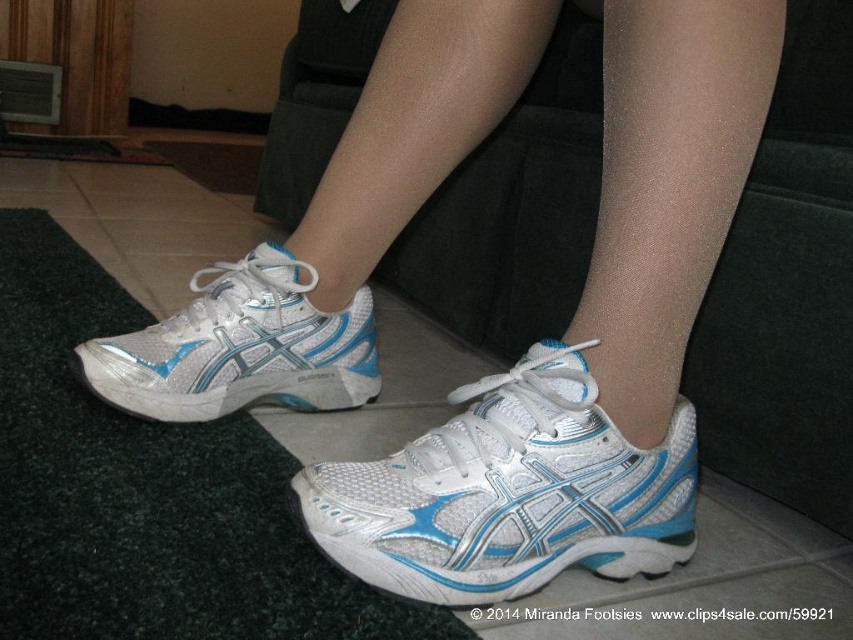
Question: Is white mesh shoe at center closer to the viewer compared to white mesh shoe at left?

Choices:
 (A) no
 (B) yes

Answer: (B)

Question: Does white mesh shoe at center appear over white mesh shoe at left?

Choices:
 (A) no
 (B) yes

Answer: (A)

Question: Which object is closer to the camera taking this photo?

Choices:
 (A) white mesh shoe at left
 (B) white mesh shoe at center

Answer: (B)

Question: Which point is farther from the camera taking this photo?

Choices:
 (A) click(x=186, y=358)
 (B) click(x=596, y=516)

Answer: (A)

Question: Which of the following is the closest to the observer?

Choices:
 (A) white mesh shoe at left
 (B) white mesh shoe at center

Answer: (B)

Question: Can you confirm if white mesh shoe at center is wider than white mesh shoe at left?

Choices:
 (A) no
 (B) yes

Answer: (B)